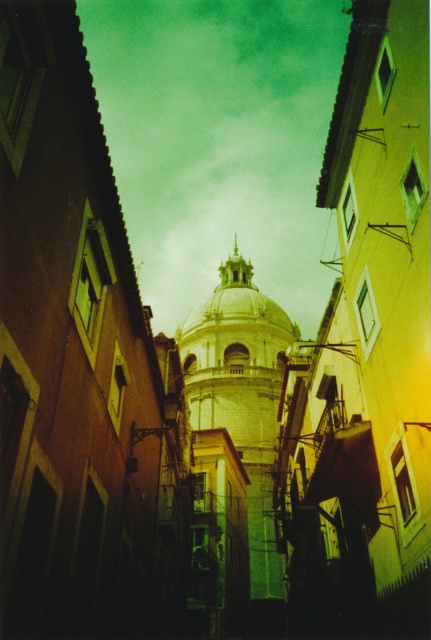
Which of these two, white stone dome at center or gold textured dome at center, stands taller?

white stone dome at center

Describe the element at coordinates (234, 451) in the screenshot. I see `white stone dome at center` at that location.

Who is more forward, (231, 552) or (237, 296)?

Point (231, 552)

Find the location of a particular element. This screenshot has width=431, height=640. white stone dome at center is located at coordinates (234, 451).